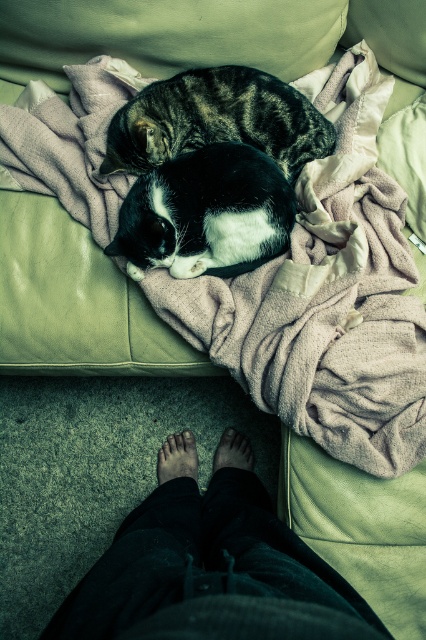
You are a delivery robot trying to navigate to the couch in the image. The couch is located at the center of the room. You need to avoid obstacles. Based on the coordinates given, can you determine if the dark blue jeans at lower center are directly in front of the couch or to the side?

The dark blue jeans at lower center are located at coordinates point (210, 573). Since the couch is at the center, the jeans are positioned to the side rather than directly in front.

You are a cat owner who wants to cover your cats with the soft beige blanket at center without disturbing them. Since the blanket is larger than the brown matte foot at lower center, will the blanket be big enough to cover both cats and the foot?

The soft beige blanket at center has a larger size compared to brown matte foot at lower center, so the blanket is big enough to cover both cats and the foot.